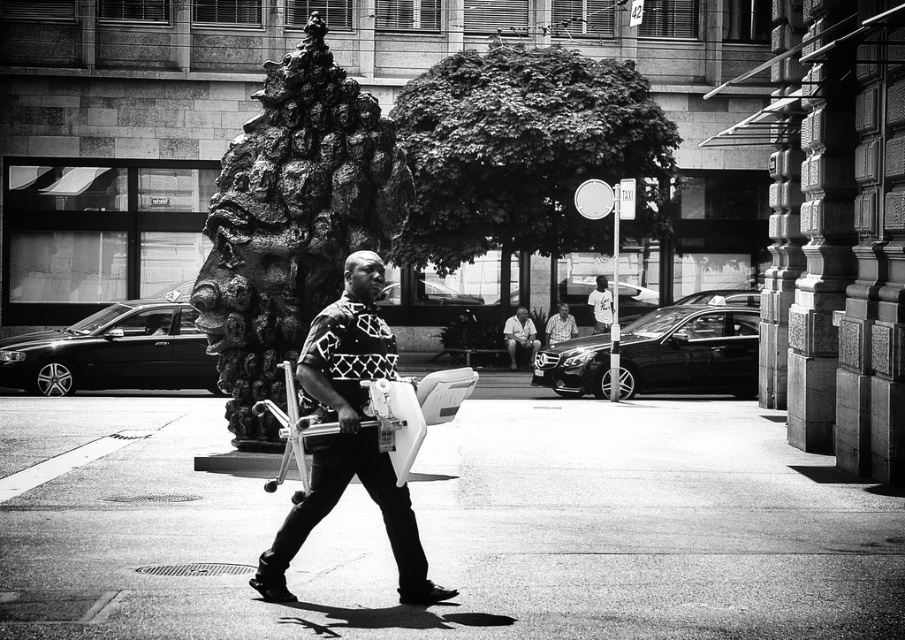
Question: Can you confirm if light brown leather jacket at center is positioned to the left of patterned fabric shirt at center?

Choices:
 (A) yes
 (B) no

Answer: (A)

Question: Which of the following is the closest to the observer?

Choices:
 (A) smooth concrete pavement at center
 (B) white cotton shirt at center

Answer: (A)

Question: Considering the relative positions of smooth concrete pavement at center and patterned fabric skateboard at center in the image provided, where is smooth concrete pavement at center located with respect to patterned fabric skateboard at center?

Choices:
 (A) left
 (B) right

Answer: (B)

Question: Which of the following is the farthest from the observer?

Choices:
 (A) (237, 173)
 (B) (388, 529)
 (C) (567, 326)
 (D) (531, 324)

Answer: (C)

Question: Which point is closer to the camera?

Choices:
 (A) patterned fabric shirt at center
 (B) white cotton shirt at center
 (C) smooth concrete pavement at center

Answer: (C)

Question: Does smooth concrete pavement at center come in front of white cotton shirt at center?

Choices:
 (A) yes
 (B) no

Answer: (A)